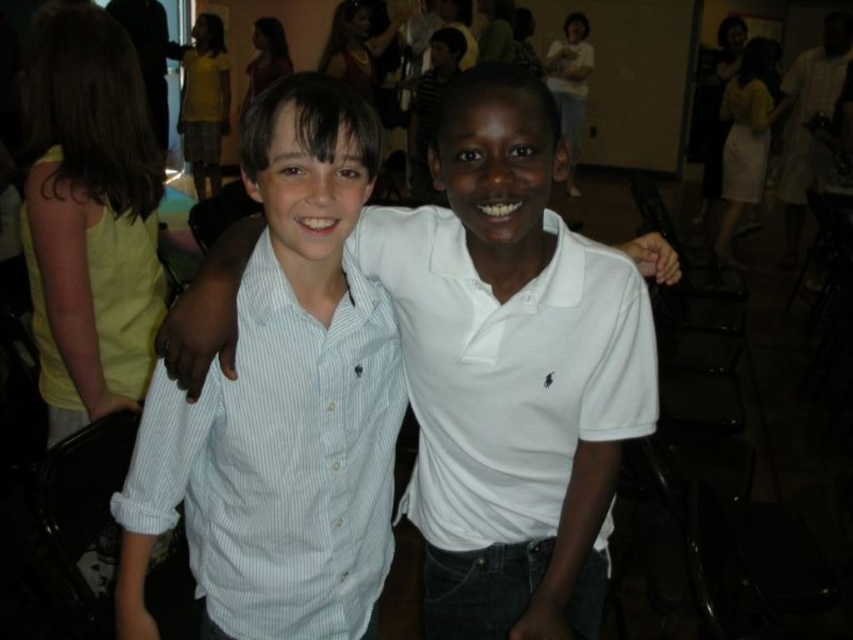
Question: Does white striped shirt at center lie in front of white cotton polo shirt at center?

Choices:
 (A) yes
 (B) no

Answer: (A)

Question: Which of the following is the farthest from the observer?

Choices:
 (A) white striped shirt at center
 (B) white cotton shirt at center

Answer: (A)

Question: Which point appears farthest from the camera in this image?

Choices:
 (A) (503, 131)
 (B) (596, 298)
 (C) (215, 618)

Answer: (C)

Question: Which object is positioned farthest from the white striped shirt at center?

Choices:
 (A) white cotton polo shirt at center
 (B) white cotton shirt at center

Answer: (A)

Question: Can you confirm if white cotton polo shirt at center is positioned to the right of white cotton shirt at center?

Choices:
 (A) no
 (B) yes

Answer: (B)

Question: Does white cotton polo shirt at center appear on the right side of white cotton shirt at center?

Choices:
 (A) no
 (B) yes

Answer: (B)